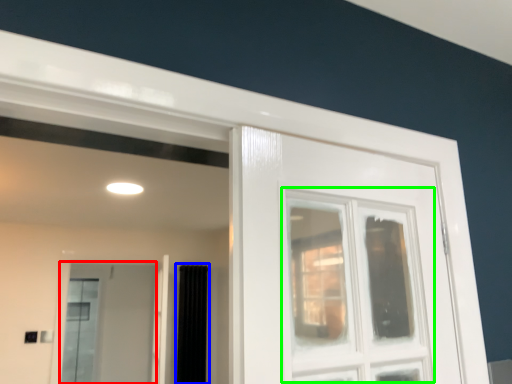
Question: Considering the real-world distances, which object is farthest from screen door (highlighted by a red box)? curtain (highlighted by a blue box) or window (highlighted by a green box)?

Choices:
 (A) curtain
 (B) window

Answer: (B)